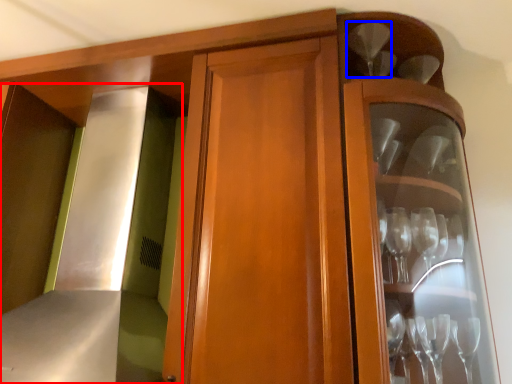
Question: Which point is further to the camera, exhaust hood (highlighted by a red box) or wine glass (highlighted by a blue box)?

Choices:
 (A) exhaust hood
 (B) wine glass

Answer: (B)